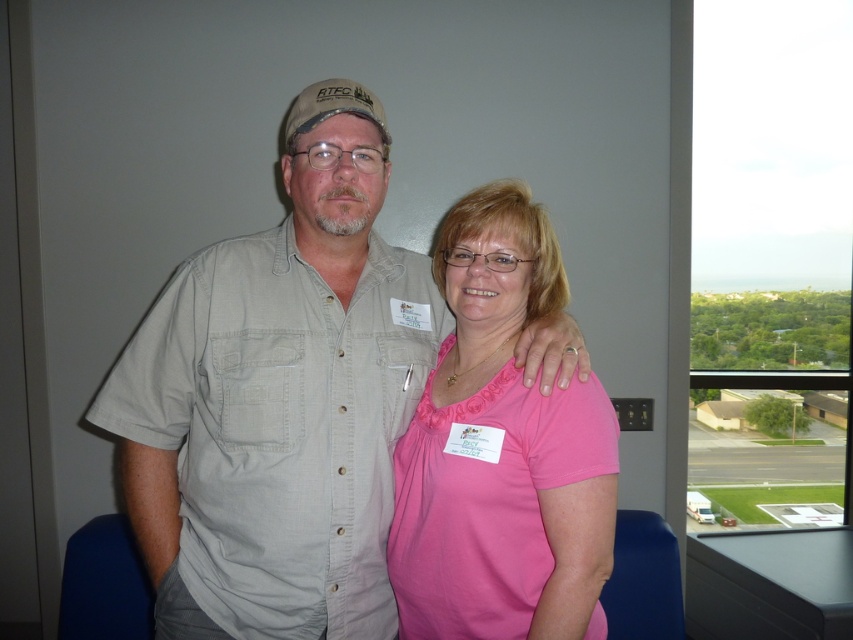
Question: Can you confirm if matte khaki shirt at center is smaller than pink matte shirt at center?

Choices:
 (A) no
 (B) yes

Answer: (A)

Question: Does matte khaki shirt at center lie in front of pink matte shirt at center?

Choices:
 (A) no
 (B) yes

Answer: (A)

Question: Which of the following is the closest to the observer?

Choices:
 (A) (380, 344)
 (B) (494, 188)

Answer: (A)

Question: Where is matte khaki shirt at center located in relation to pink matte shirt at center in the image?

Choices:
 (A) right
 (B) left

Answer: (B)

Question: Which of the following is the farthest from the observer?

Choices:
 (A) (409, 289)
 (B) (572, 596)

Answer: (A)